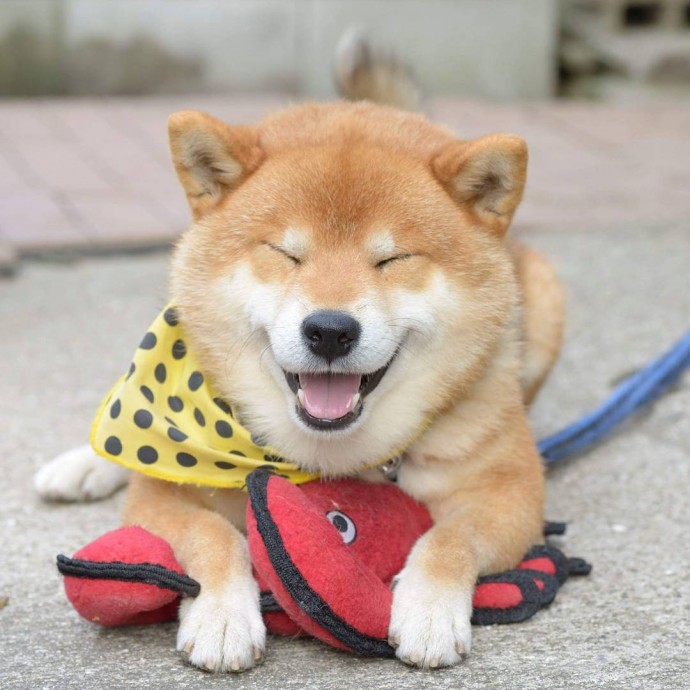
Where is `wall blurry`? The height and width of the screenshot is (690, 690). wall blurry is located at coordinates (511, 41).